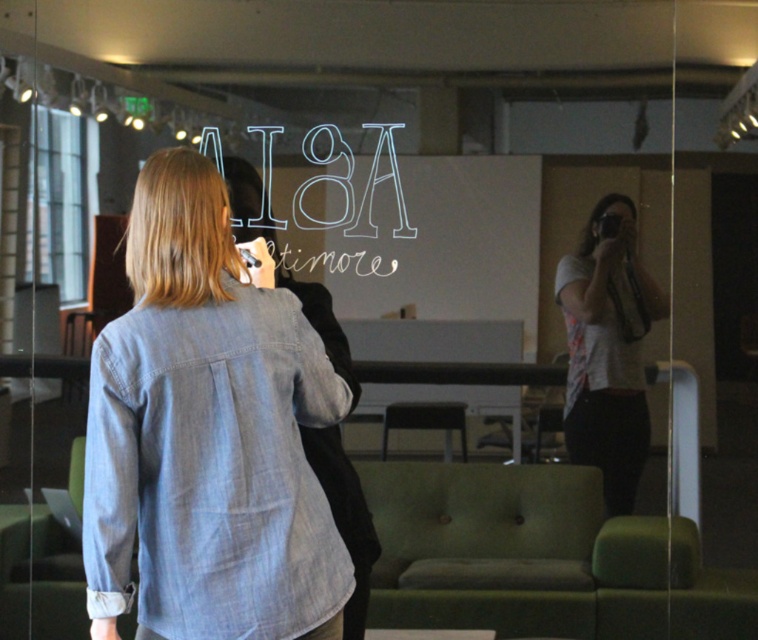
Question: Estimate the real-world distances between objects in this image. Which object is farther from the white chalk writing at center?

Choices:
 (A) light blue denim shirt at center
 (B) white printed shirt at center

Answer: (A)

Question: Does light blue denim shirt at center appear over white chalk writing at center?

Choices:
 (A) no
 (B) yes

Answer: (A)

Question: Does light blue denim shirt at center appear over white printed shirt at center?

Choices:
 (A) yes
 (B) no

Answer: (B)

Question: Considering the real-world distances, which object is closest to the white chalk writing at center?

Choices:
 (A) white printed shirt at center
 (B) light blue denim shirt at center

Answer: (A)

Question: Among these objects, which one is farthest from the camera?

Choices:
 (A) light blue denim shirt at center
 (B) white chalk writing at center

Answer: (B)

Question: Does light blue denim shirt at center appear on the left side of white printed shirt at center?

Choices:
 (A) yes
 (B) no

Answer: (A)